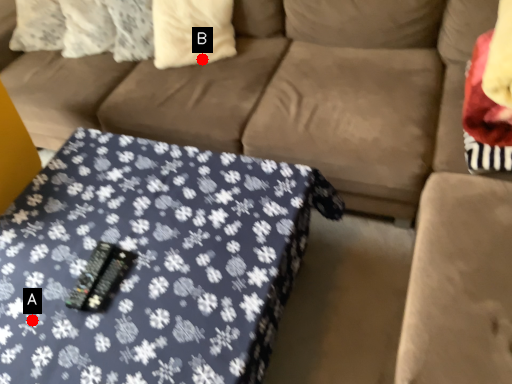
Question: Two points are circled on the image, labeled by A and B beside each circle. Which point is farther to the camera?

Choices:
 (A) A is further
 (B) B is further

Answer: (B)